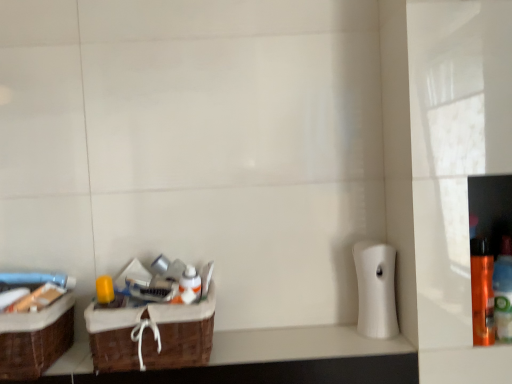
You are a GUI agent. You are given a task and a screenshot of the screen. Output one action in this format:
    pyautogui.click(x=<x>, y=<y>)
    Task: Click on the brown woven basket at lower left
    The image size is (512, 384).
    Given the screenshot: What is the action you would take?
    pyautogui.click(x=268, y=360)

Where is `orange matte bottle at right, marked as the 2th bottle in a left-to-right arrangement`? orange matte bottle at right, marked as the 2th bottle in a left-to-right arrangement is located at coordinates (503, 290).

Locate an element on the screen. white matte toilet paper at right is located at coordinates (376, 289).

The image size is (512, 384). Identify the location of brown woven basket at lower left. (268, 360).

Is brown woven basket at lower left, the 1th box in the right-to-left sequence, smaller than brown woven basket at left, positioned as the 1th box in left-to-right order?

No.

How different are the orientations of brown woven basket at lower left, the 1th box in the right-to-left sequence, and brown woven basket at left, positioned as the 1th box in left-to-right order, in degrees?

The facing directions of brown woven basket at lower left, the 1th box in the right-to-left sequence, and brown woven basket at left, positioned as the 1th box in left-to-right order, are 0.168 degrees apart.

Does brown woven basket at lower left, the 1th box in the right-to-left sequence, appear on the right side of brown woven basket at left, acting as the 2th box starting from the right?

Yes.

Between brown woven basket at lower left, the 1th box in the right-to-left sequence, and brown woven basket at left, positioned as the 1th box in left-to-right order, which one has more height?

brown woven basket at lower left, the 1th box in the right-to-left sequence.

Can you confirm if brown woven basket at left, positioned as the 1th box in left-to-right order, is bigger than white matte toilet paper at right?

Yes, brown woven basket at left, positioned as the 1th box in left-to-right order, is bigger than white matte toilet paper at right.

Considering the sizes of brown woven basket at left, acting as the 2th box starting from the right, and white matte toilet paper at right in the image, is brown woven basket at left, acting as the 2th box starting from the right, wider or thinner than white matte toilet paper at right?

Considering their sizes, brown woven basket at left, acting as the 2th box starting from the right, looks broader than white matte toilet paper at right.

Does brown woven basket at left, positioned as the 1th box in left-to-right order, appear on the right side of white matte toilet paper at right?

In fact, brown woven basket at left, positioned as the 1th box in left-to-right order, is to the left of white matte toilet paper at right.

Locate an element on the screen. The image size is (512, 384). mouthwash behind the brown woven basket at lower left, the 1th box in the right-to-left sequence is located at coordinates (189, 286).

Which point is more forward, (190, 286) or (170, 347)?

The point (170, 347) is in front.

Are white glossy bottle at center and brown woven basket at lower left, the 1th box in the right-to-left sequence, located far from each other?

white glossy bottle at center is near brown woven basket at lower left, the 1th box in the right-to-left sequence, not far away.

From the image's perspective, is white glossy bottle at center positioned above or below brown woven basket at lower left, which is the second box from left to right?

Clearly, from the image's perspective, white glossy bottle at center is above brown woven basket at lower left, which is the second box from left to right.

Is white glossy bottle at center situated inside orange matte bottle at right, which is counted as the first bottle, starting from the right, or outside?

The correct answer is: outside.

Measure the distance between white glossy bottle at center and orange matte bottle at right, which is counted as the first bottle, starting from the right.

The distance of white glossy bottle at center from orange matte bottle at right, which is counted as the first bottle, starting from the right, is 23.90 inches.

Is white glossy bottle at center touching orange matte bottle at right, marked as the 2th bottle in a left-to-right arrangement?

No, white glossy bottle at center is not next to orange matte bottle at right, marked as the 2th bottle in a left-to-right arrangement.

Is white glossy bottle at center bigger or smaller than orange matte bottle at right, which is counted as the first bottle, starting from the right?

Considering their sizes, white glossy bottle at center takes up less space than orange matte bottle at right, which is counted as the first bottle, starting from the right.

Is brown woven basket at lower left, which is the second box from left to right, touching white matte toilet paper at right?

No, brown woven basket at lower left, which is the second box from left to right, is not beside white matte toilet paper at right.

Considering the sizes of objects brown woven basket at lower left, the 1th box in the right-to-left sequence, and white matte toilet paper at right in the image provided, who is thinner, brown woven basket at lower left, the 1th box in the right-to-left sequence, or white matte toilet paper at right?

With smaller width is white matte toilet paper at right.

Find the location of a particular element. This screenshot has height=384, width=512. toilet paper above the brown woven basket at lower left, which is the second box from left to right (from a real-world perspective) is located at coordinates (376, 289).

How different are the orientations of brown woven basket at lower left, the 1th box in the right-to-left sequence, and white matte toilet paper at right in degrees?

The facing directions of brown woven basket at lower left, the 1th box in the right-to-left sequence, and white matte toilet paper at right are 3.3 degrees apart.

In the scene shown: Considering their positions, is brown woven basket at left, acting as the 2th box starting from the right, located in front of or behind brown woven basket at lower left, which is the second box from left to right?

brown woven basket at left, acting as the 2th box starting from the right, is positioned farther from the viewer than brown woven basket at lower left, which is the second box from left to right.

Does brown woven basket at left, acting as the 2th box starting from the right, turn towards brown woven basket at lower left, which is the second box from left to right?

No, brown woven basket at left, acting as the 2th box starting from the right, is not turned towards brown woven basket at lower left, which is the second box from left to right.

Does point (47, 315) come farther from viewer compared to point (210, 296)?

No, it is not.

Is brown woven basket at left, positioned as the 1th box in left-to-right order, directly adjacent to brown woven basket at lower left, which is the second box from left to right?

No.

Which is further, (2, 348) or (181, 290)?

The point (181, 290) is behind.

How much distance is there between brown woven basket at left, positioned as the 1th box in left-to-right order, and white glossy bottle at center?

brown woven basket at left, positioned as the 1th box in left-to-right order, is 27.18 centimeters from white glossy bottle at center.

Does brown woven basket at left, positioned as the 1th box in left-to-right order, contain white glossy bottle at center?

Actually, white glossy bottle at center is outside brown woven basket at left, positioned as the 1th box in left-to-right order.

Does brown woven basket at left, positioned as the 1th box in left-to-right order, have a larger size compared to white glossy bottle at center?

Correct, brown woven basket at left, positioned as the 1th box in left-to-right order, is larger in size than white glossy bottle at center.

The width and height of the screenshot is (512, 384). I want to click on box above the brown woven basket at left, positioned as the 1th box in left-to-right order (from the image's perspective), so coord(151,335).

I want to click on the 2nd box below the white matte toilet paper at right (from a real-world perspective), so point(35,339).

Estimate the real-world distances between objects in this image. Which object is further from white glossy bottle at center, brown woven basket at lower left or orange glossy spray can at right, which is counted as the 1th bottle, starting from the left?

Among the two, orange glossy spray can at right, which is counted as the 1th bottle, starting from the left, is located further to white glossy bottle at center.

From the image, which object appears to be nearer to brown woven basket at lower left, which is the second box from left to right, orange matte bottle at right, which is counted as the first bottle, starting from the right, or white matte toilet paper at right?

The object closer to brown woven basket at lower left, which is the second box from left to right, is white matte toilet paper at right.

Considering their positions, is brown woven basket at left, positioned as the 1th box in left-to-right order, positioned further to brown woven basket at lower left than orange matte bottle at right, which is counted as the first bottle, starting from the right?

Based on the image, orange matte bottle at right, which is counted as the first bottle, starting from the right, appears to be further to brown woven basket at lower left.

From the image, which object appears to be farther from white glossy bottle at center, brown woven basket at left, positioned as the 1th box in left-to-right order, or brown woven basket at lower left, the 1th box in the right-to-left sequence?

Based on the image, brown woven basket at left, positioned as the 1th box in left-to-right order, appears to be further to white glossy bottle at center.

When comparing their distances from orange matte bottle at right, marked as the 2th bottle in a left-to-right arrangement, does brown woven basket at lower left, which is the second box from left to right, or white matte toilet paper at right seem further?

The object further to orange matte bottle at right, marked as the 2th bottle in a left-to-right arrangement, is brown woven basket at lower left, which is the second box from left to right.

Considering their positions, is brown woven basket at left, positioned as the 1th box in left-to-right order, positioned further to white matte toilet paper at right than brown woven basket at lower left?

brown woven basket at left, positioned as the 1th box in left-to-right order, lies further to white matte toilet paper at right than the other object.

When comparing their distances from white glossy bottle at center, does white matte toilet paper at right or brown woven basket at lower left seem closer?

The object closer to white glossy bottle at center is brown woven basket at lower left.

When comparing their distances from brown woven basket at lower left, which is the second box from left to right, does brown woven basket at lower left or white matte toilet paper at right seem further?

white matte toilet paper at right is positioned further to the anchor brown woven basket at lower left, which is the second box from left to right.

Identify the location of toilet paper between brown woven basket at lower left, which is the second box from left to right, and orange glossy spray can at right, which is counted as the 1th bottle, starting from the left, from left to right. The width and height of the screenshot is (512, 384). (376, 289).

I want to click on mouthwash between brown woven basket at left, acting as the 2th box starting from the right, and white matte toilet paper at right from left to right, so click(x=189, y=286).

You are a GUI agent. You are given a task and a screenshot of the screen. Output one action in this format:
    pyautogui.click(x=<x>, y=<y>)
    Task: Click on the bottle situated between brown woven basket at lower left, the 1th box in the right-to-left sequence, and orange matte bottle at right, marked as the 2th bottle in a left-to-right arrangement, from left to right
    
    Given the screenshot: What is the action you would take?
    pyautogui.click(x=482, y=292)

Identify the location of toilet paper between brown woven basket at lower left and orange glossy spray can at right, which is counted as the 1th bottle, starting from the left, from left to right. This screenshot has height=384, width=512. (376, 289).